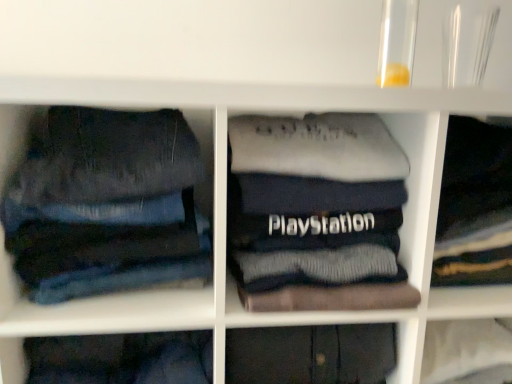
Question: Does point (182, 155) appear closer or farther from the camera than point (498, 142)?

Choices:
 (A) farther
 (B) closer

Answer: (B)

Question: Considering the positions of denim jeans at left and dark gray sweater at center, acting as the 1th clothing starting from the right, in the image, is denim jeans at left wider or thinner than dark gray sweater at center, acting as the 1th clothing starting from the right,?

Choices:
 (A) wide
 (B) thin

Answer: (A)

Question: Based on their relative distances, which object is farther from the dark blue cotton sweatshirt at center, the second clothing from the right?

Choices:
 (A) denim jeans at left
 (B) dark gray sweater at center, acting as the 1th clothing starting from the right

Answer: (B)

Question: Estimate the real-world distances between objects in this image. Which object is closer to the dark gray sweater at center, acting as the 1th clothing starting from the right?

Choices:
 (A) denim jeans at left
 (B) dark blue cotton sweatshirt at center, which ranks as the first clothing in left-to-right order

Answer: (B)